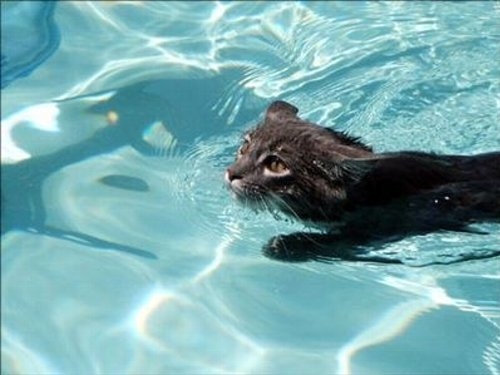
Locate an element on the screen. left front leg is located at coordinates (308, 245).